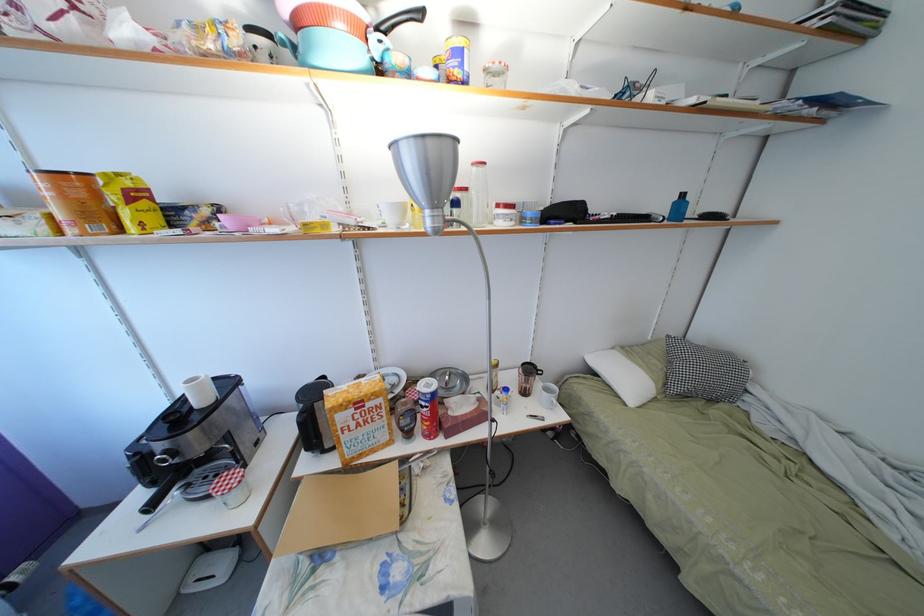
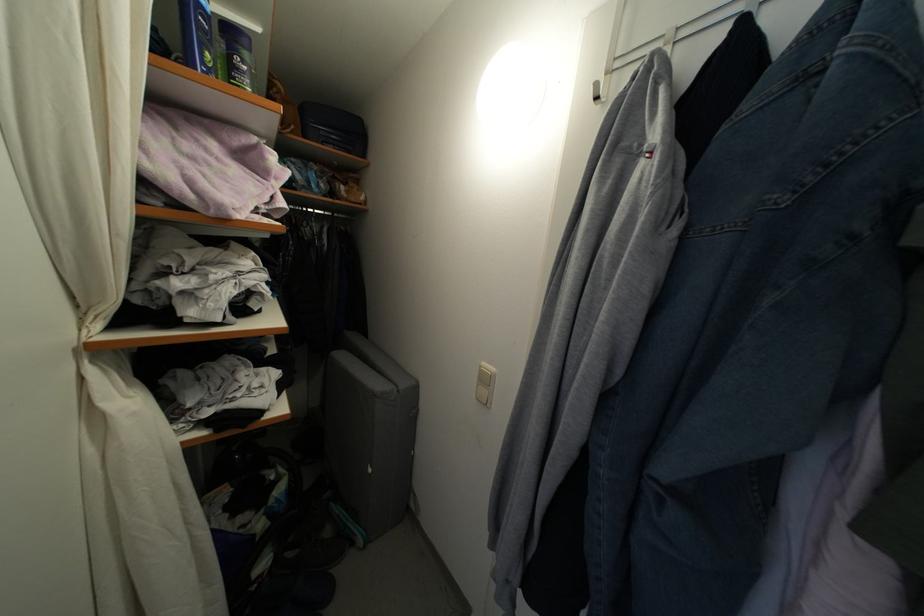
Question: The images are taken continuously from a first-person perspective. In which direction are you moving?

Choices:
 (A) Left
 (B) Right
 (C) Forward
 (D) Backward

Answer: (B)